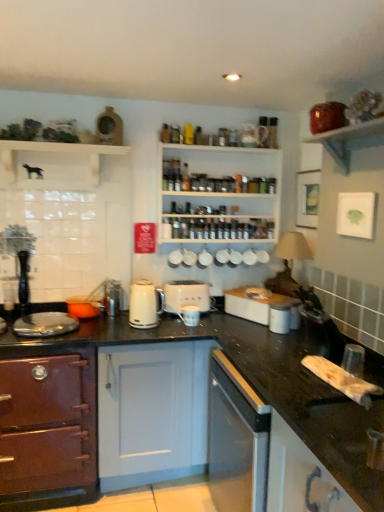
Question: Does point tap(271, 466) appear closer or farther from the camera than point tap(337, 158)?

Choices:
 (A) farther
 (B) closer

Answer: (B)

Question: From the image's perspective, is white glossy cabinet at lower right, which appears as the 2th cabinetry when viewed from the back, positioned above or below matte brown bowl at upper right, which is the 3th shelf in back-to-front order?

Choices:
 (A) above
 (B) below

Answer: (B)

Question: Based on their relative distances, which object is nearer to the white glossy cabinet at lower right, which appears as the first cabinetry when viewed from the front?

Choices:
 (A) black granite countertop at center
 (B) white wooden spice rack at upper center, which is the second shelf from left to right
 (C) white ceramic mug at upper center
 (D) white glossy kettle at center
 (E) white glossy toaster at center, arranged as the 1th appliance when viewed from the right

Answer: (A)

Question: Which object is the farthest from the black granite countertop at center?

Choices:
 (A) white ceramic mug at upper center
 (B) white wooden spice rack at upper center, the third shelf when ordered from front to back
 (C) white matte dog at upper left, which is the first shelf from left to right
 (D) matte brown bowl at upper right, the 1th shelf viewed from the front
 (E) porcelain matte mug at center, marked as the third appliance in a left-to-right arrangement

Answer: (D)